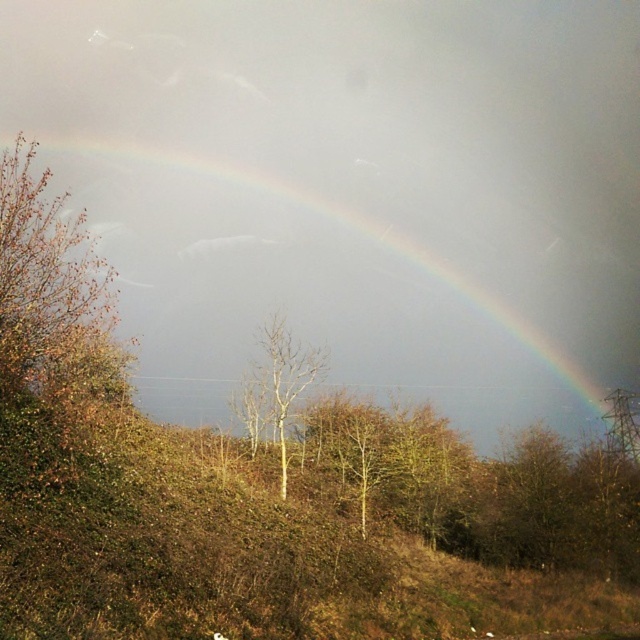
Based on the photo, who is lower down, rainbow at upper center or bare wood tree at center?

bare wood tree at center is lower down.

Which is in front, point (518, 412) or point (273, 417)?

Point (273, 417)

Locate an element on the screen. rainbow at upper center is located at coordinates (296, 301).